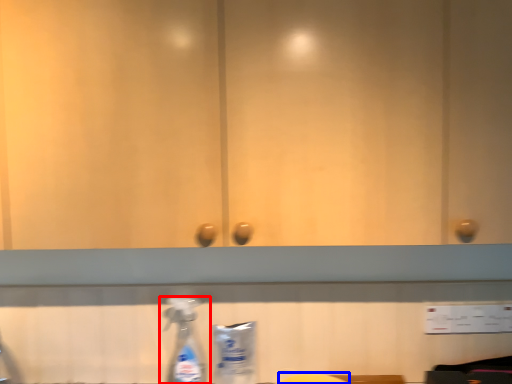
Question: Among these objects, which one is nearest to the camera, bottle (highlighted by a red box) or wide (highlighted by a blue box)?

Choices:
 (A) bottle
 (B) wide

Answer: (B)